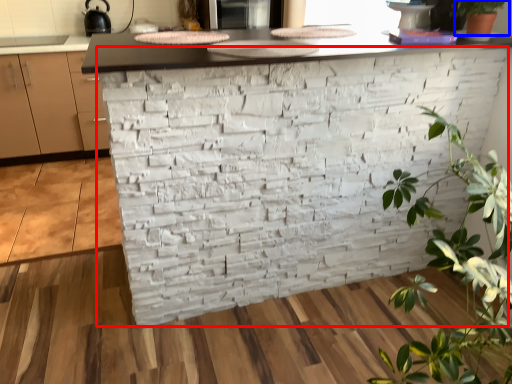
Question: Which of the following is the farthest to the observer, brickwork (highlighted by a red box) or houseplant (highlighted by a blue box)?

Choices:
 (A) brickwork
 (B) houseplant

Answer: (B)